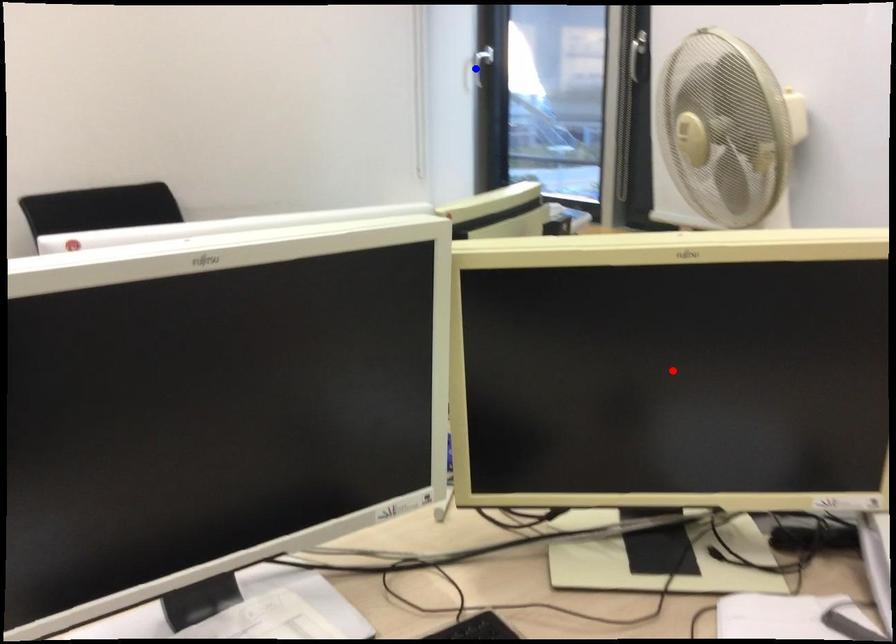
Question: Two points are marked on the image. Which point is closer to the camera?

Choices:
 (A) Blue point is closer.
 (B) Red point is closer.

Answer: (B)